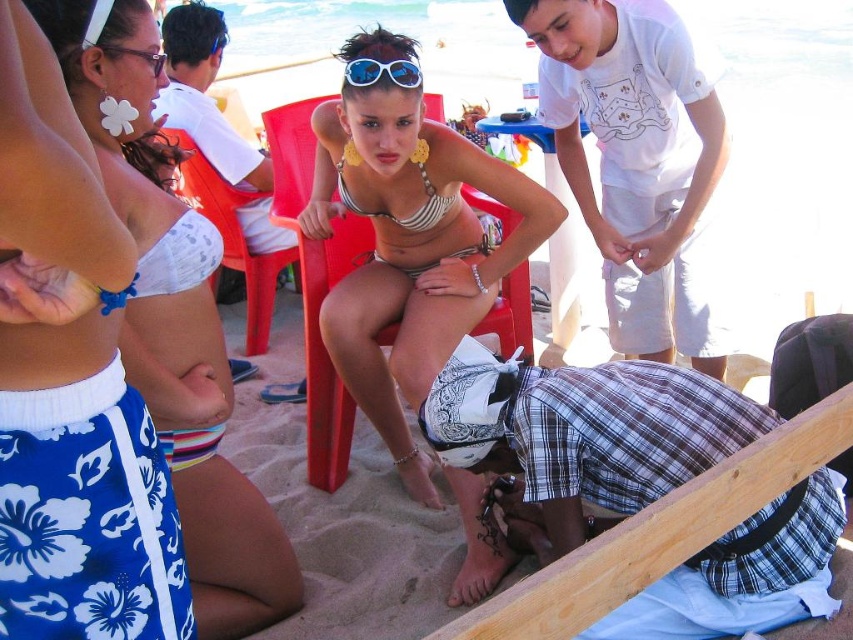
You are standing at the beach and see a point marked at coordinates (672, 16). If you want to place a 2 meter long beach umbrella there, will it fit without being too close to the viewer?

The point at coordinates (672, 16) is 2.15 meters from the viewer. Since the beach umbrella is 2 meters long, it will fit as the distance is greater than the umbrella length, ensuring it won t be too close.